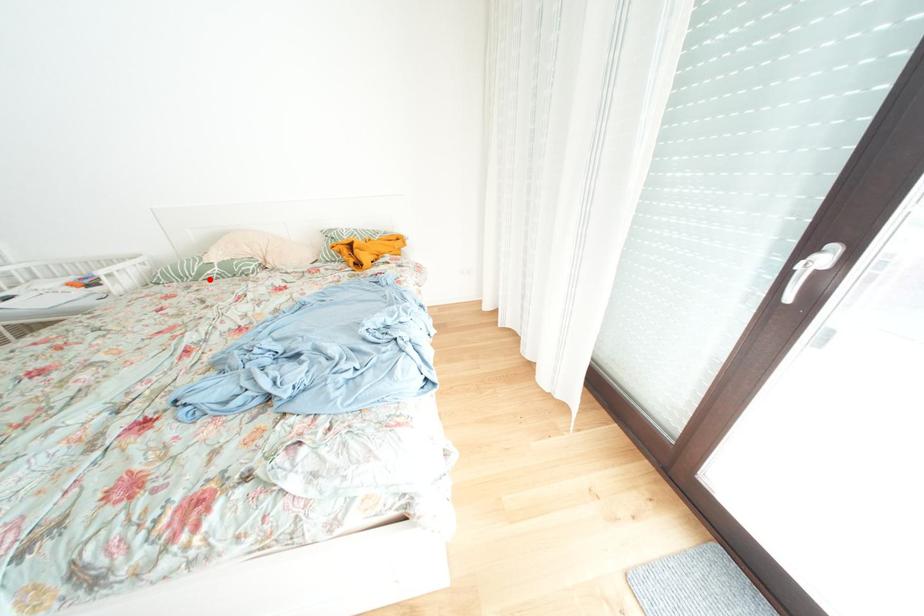
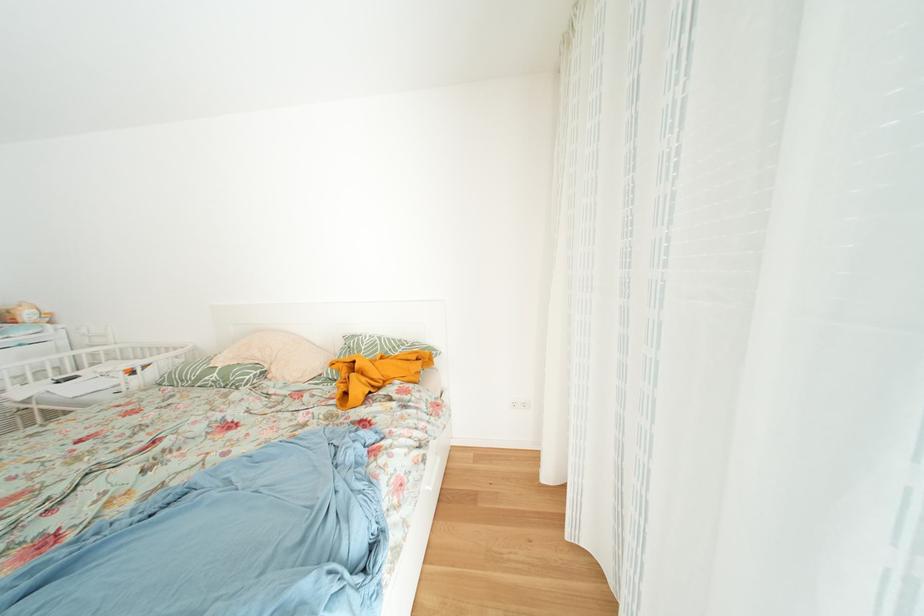
Find the pixel in the second image that matches the highlighted location in the first image.

(208, 384)